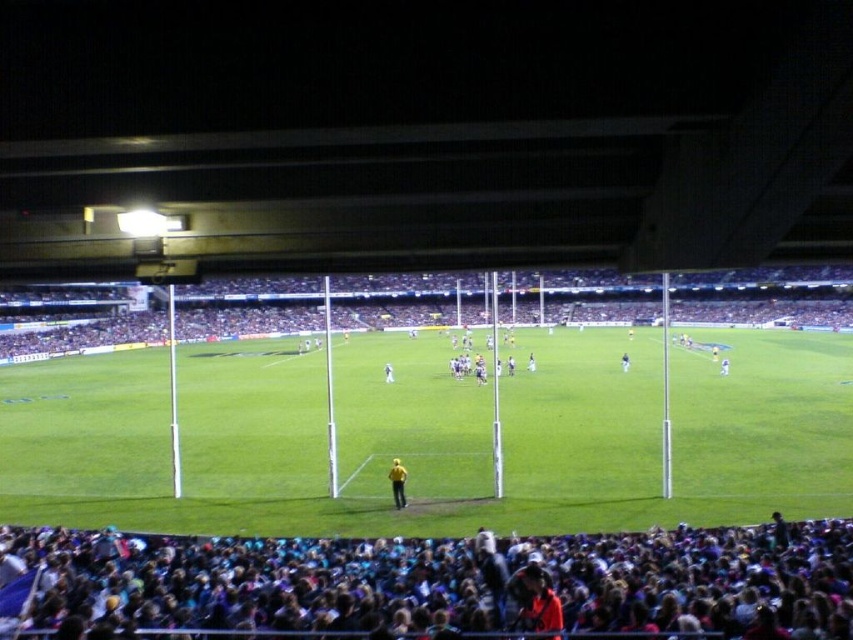
Question: Which object is positioned farthest from the green grass football field at center?

Choices:
 (A) dark blue fabric at lower center
 (B) dark blue jersey at center
 (C) white fabric person at center
 (D) blue fabric at center

Answer: (D)

Question: Which object appears farthest from the camera in this image?

Choices:
 (A) dark blue fabric at lower center
 (B) green grass football field at center
 (C) yellow fabric person at center

Answer: (C)

Question: Among these objects, which one is farthest from the camera?

Choices:
 (A) dark blue jersey at center
 (B) yellow fabric person at center
 (C) green grass football field at center

Answer: (A)

Question: Is the position of yellow fabric person at center less distant than that of white fabric person at center?

Choices:
 (A) yes
 (B) no

Answer: (A)

Question: Can you confirm if yellow fabric person at center is positioned above dark blue jersey at center?

Choices:
 (A) yes
 (B) no

Answer: (B)

Question: From the image, what is the correct spatial relationship of dark blue fabric at lower center in relation to white fabric person at center?

Choices:
 (A) right
 (B) left

Answer: (A)